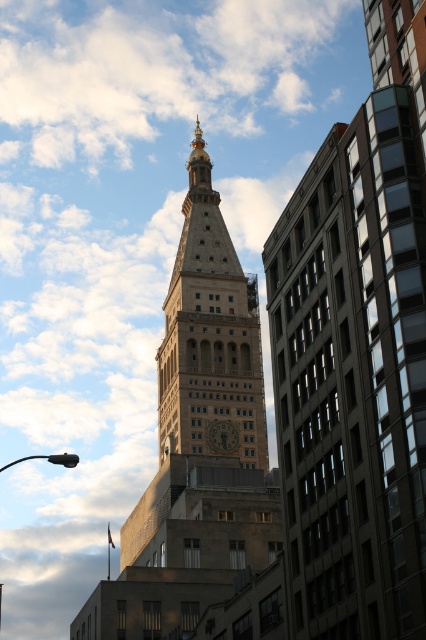
You are standing in the square and see the golden stone clock tower at center. There is a point marked at coordinates point (x=210, y=333). Can you tell me what object this point is located on?

The point (x=210, y=333) is located on the golden stone clock tower at center.